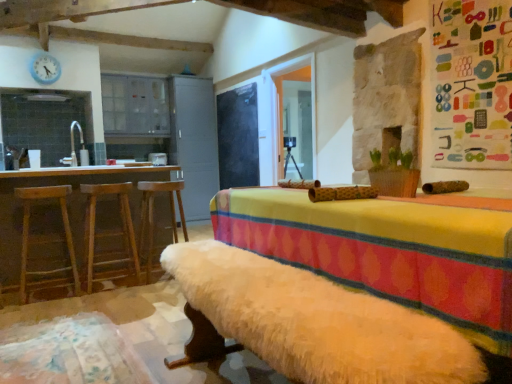
At what (x,y) coordinates should I click in order to perform the action: click on vacant area located to the right-hand side of wooden bar stool at left, the 1th bar stool from the left. Please return your answer as a coordinate pair (x, y). Image resolution: width=512 pixels, height=384 pixels. Looking at the image, I should click on (89, 297).